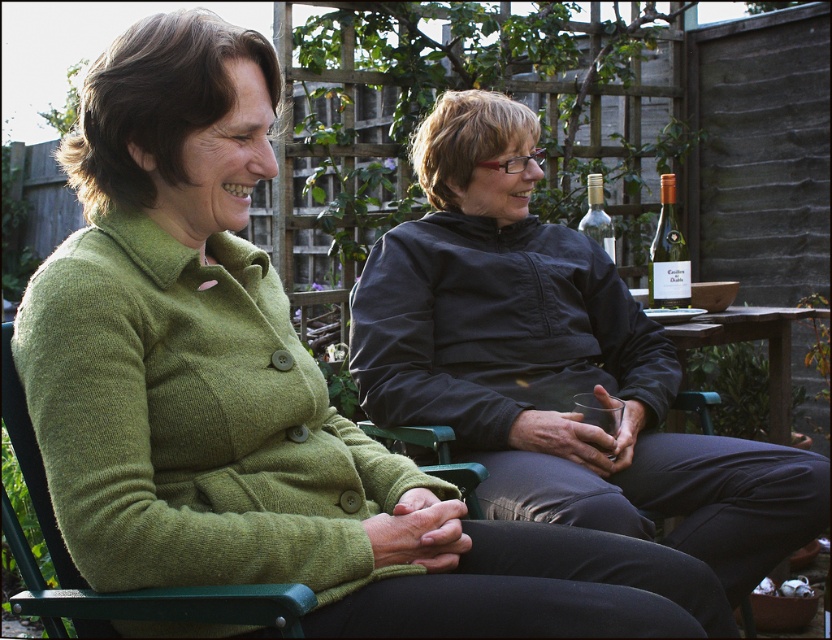
Who is taller, matte black jacket at center or clear glass bottle at upper right?

With more height is matte black jacket at center.

You are a GUI agent. You are given a task and a screenshot of the screen. Output one action in this format:
    pyautogui.click(x=<x>, y=<y>)
    Task: Click on the matte black jacket at center
    The image size is (832, 640).
    Given the screenshot: What is the action you would take?
    pyautogui.click(x=553, y=362)

The image size is (832, 640). Identify the location of matte black jacket at center. (553, 362).

Does matte black jacket at center have a lesser width compared to translucent glass wine bottle at right?

Incorrect, matte black jacket at center's width is not less than translucent glass wine bottle at right's.

Describe the element at coordinates (553, 362) in the screenshot. The width and height of the screenshot is (832, 640). I see `matte black jacket at center` at that location.

At what (x,y) coordinates should I click in order to perform the action: click on matte black jacket at center. Please return your answer as a coordinate pair (x, y). This screenshot has width=832, height=640. Looking at the image, I should click on (553, 362).

Locate an element on the screen. The image size is (832, 640). translucent glass wine bottle at right is located at coordinates (667, 256).

Is point (669, 243) closer to camera compared to point (588, 221)?

Yes, it is in front of point (588, 221).

Identify the location of translucent glass wine bottle at right. This screenshot has height=640, width=832. (667, 256).

Locate an element on the screen. translucent glass wine bottle at right is located at coordinates (667, 256).